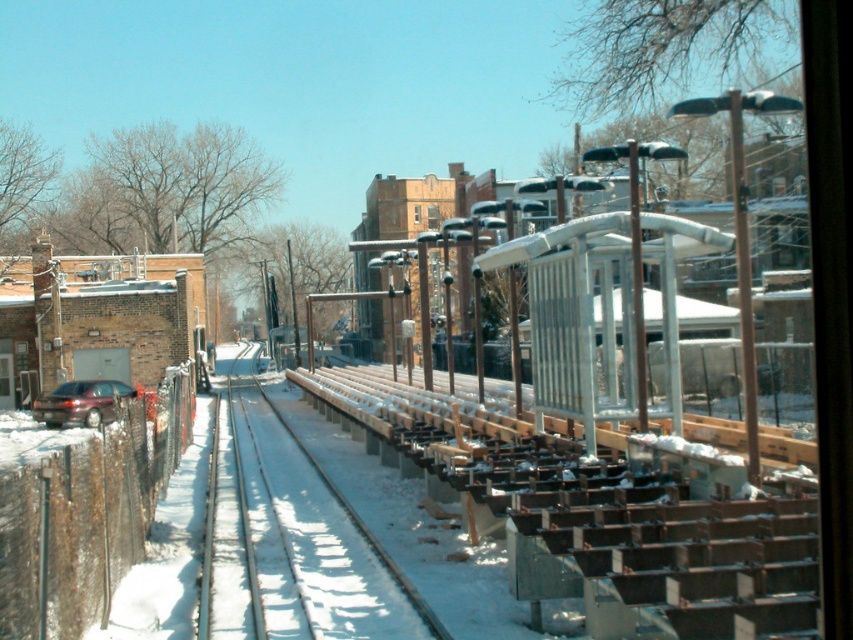
Consider the image. You are a traveler carrying a heavy backpack and need to sit down. You see a wooden bench at center and a matte dark brown car at left. Which one is shorter so you can sit without hitting your head?

The wooden bench at center has a lesser height compared to the matte dark brown car at left, so you can sit on the wooden bench at center without hitting your head.

Consider the image. You are a traveler who just arrived at the train station and need to sit down. You see the wooden bench at center and the matte dark brown car at left. Which object is closer to you if you are standing on the tracks?

The wooden bench at center is closer to you because it is positioned under the matte dark brown car at left, meaning the car is further away from the tracks.

You are standing at the train station platform and want to take a photo that includes both the brick building with a garage door and the metal shelter structure. Which point, point (248, 621) or point (105, 388), should you position yourself closer to in order to ensure both structures are in the frame?

You should position yourself closer to point (248, 621) because it is closer to the camera than point (105, 388), allowing both the brick building with a garage door and the metal shelter structure to be captured in the frame.